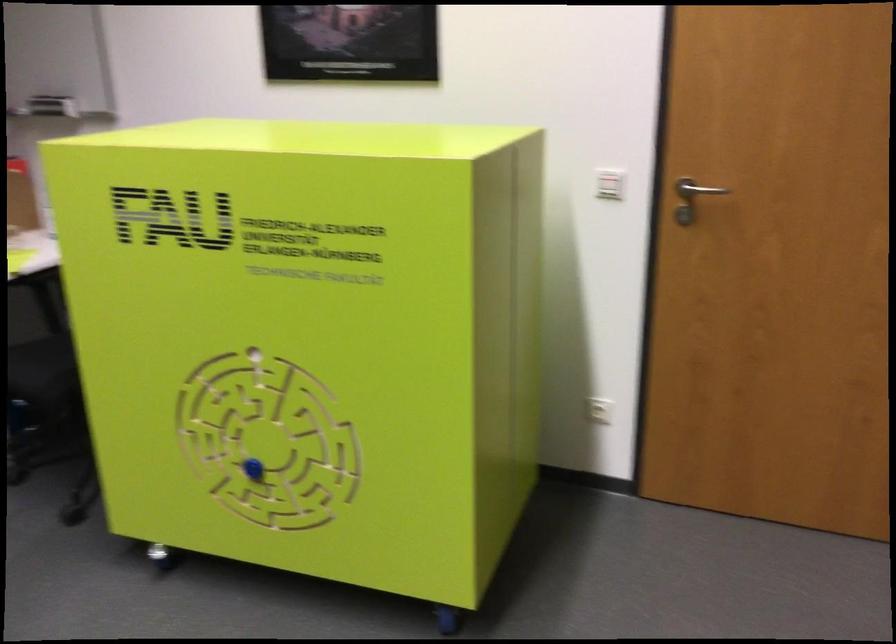
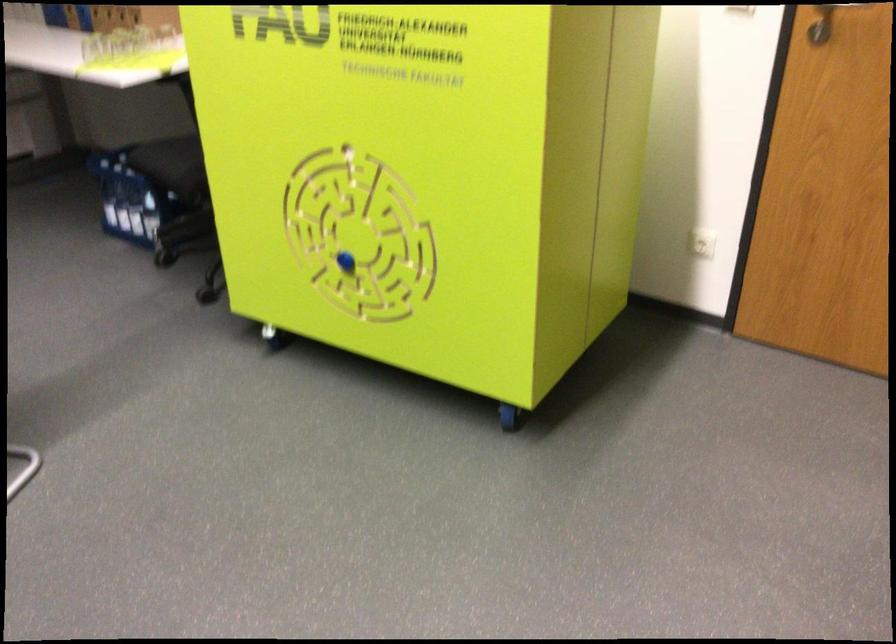
Locate, in the second image, the point that corresponds to point 254,468 in the first image.

(346, 261)